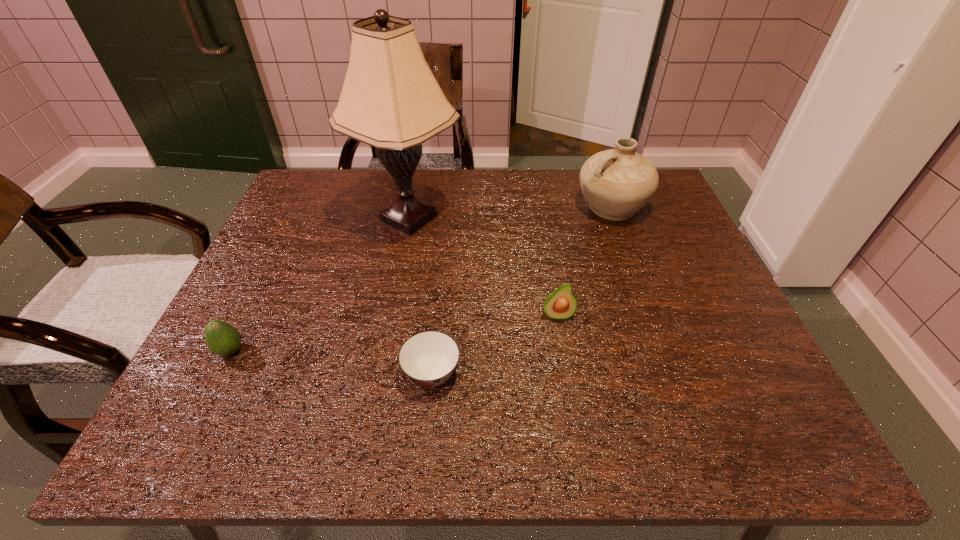
The width and height of the screenshot is (960, 540). I want to click on vacant area that lies between the shortest object and the second object from right to left, so click(494, 345).

Image resolution: width=960 pixels, height=540 pixels. Identify the location of vacant space in between the lamp and the right avocado. (483, 267).

Locate an element on the screen. Image resolution: width=960 pixels, height=540 pixels. the closest object to the third nearest object is located at coordinates (428, 358).

Identify which object is the fourth closest to the third farthest object. Please provide its 2D coordinates. Your answer should be formatted as a tuple, i.e. [(x, y)], where the tuple contains the x and y coordinates of a point satisfying the conditions above.

[(223, 339)]

What are the coordinates of `vacant space that satisfies the following two spatial constraints: 1. on the back side of the second tallest object; 2. on the right side of the shortest object` in the screenshot? It's located at (447, 207).